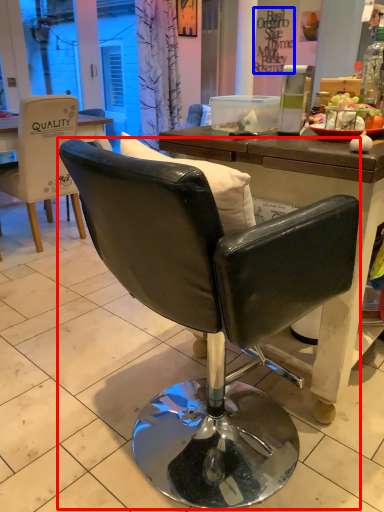
Question: Which of the following is the farthest to the observer, chair (highlighted by a red box) or writing (highlighted by a blue box)?

Choices:
 (A) chair
 (B) writing

Answer: (B)